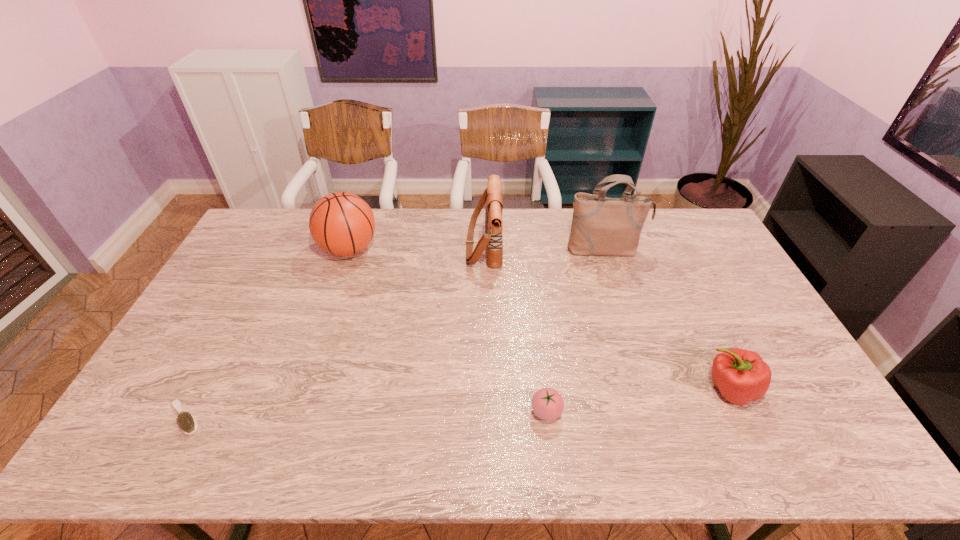
I want to click on scrubbing brush, so click(x=187, y=423).

I want to click on vacant space located 0.120m on the front-facing side of the second object from right to left, so click(x=616, y=284).

This screenshot has width=960, height=540. Identify the location of free spot located 0.310m on the right of the second object from left to right. (465, 249).

Image resolution: width=960 pixels, height=540 pixels. In order to click on free space located 0.350m on the front-facing side of the shorter shoulder bag in this screenshot , I will do `click(370, 245)`.

Identify the location of free space located 0.170m on the front-facing side of the shorter shoulder bag. (419, 245).

You are a GUI agent. You are given a task and a screenshot of the screen. Output one action in this format:
    pyautogui.click(x=<x>, y=<y>)
    Task: Click on the vacant point located 0.250m on the front-facing side of the shorter shoulder bag
    
    Given the screenshot: What is the action you would take?
    pyautogui.click(x=397, y=245)

Where is `blank space located on the back of the bell pepper`? blank space located on the back of the bell pepper is located at coordinates (711, 350).

Locate an element on the screen. The image size is (960, 540). free region located on the back of the third object from right to left is located at coordinates (533, 299).

The image size is (960, 540). What are the coordinates of `vacant position located on the back of the leftmost object` in the screenshot? It's located at (207, 375).

I want to click on basketball located at the far edge, so click(x=341, y=223).